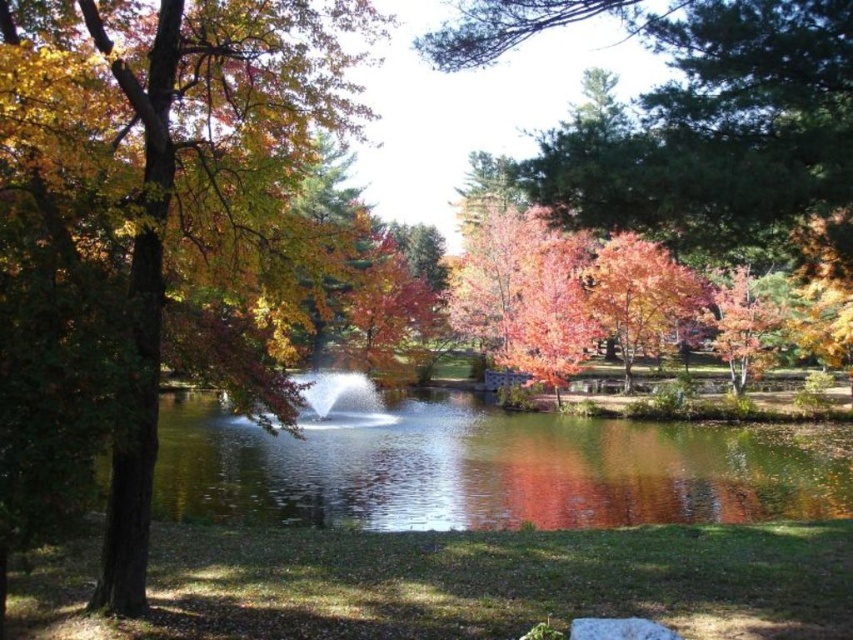
Question: Among these objects, which one is farthest from the camera?

Choices:
 (A) clear water at center
 (B) white frothy water at center

Answer: (B)

Question: Considering the relative positions of clear water at center and white frothy water at center in the image provided, where is clear water at center located with respect to white frothy water at center?

Choices:
 (A) right
 (B) left

Answer: (A)

Question: Does matte brown tree trunk at left have a smaller size compared to clear water at center?

Choices:
 (A) yes
 (B) no

Answer: (B)

Question: Can you confirm if matte brown tree trunk at left is positioned above white frothy water at center?

Choices:
 (A) yes
 (B) no

Answer: (A)

Question: Which of the following is the farthest from the observer?

Choices:
 (A) (28, 120)
 (B) (328, 493)
 (C) (392, 419)

Answer: (C)

Question: Which point appears closest to the camera in this image?

Choices:
 (A) (759, 515)
 (B) (210, 316)

Answer: (B)